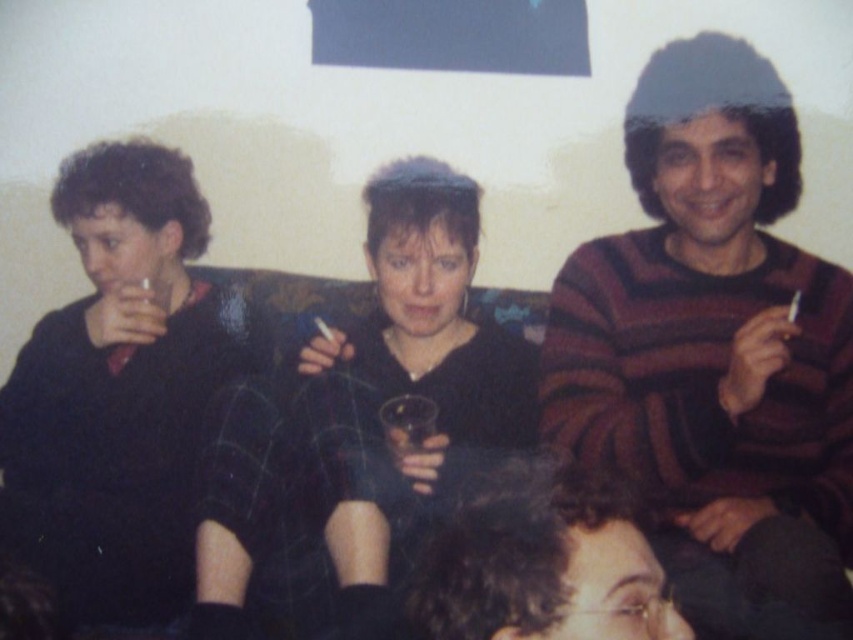
Does dark curly hair at lower center appear on the right side of translucent glass at center?

Indeed, dark curly hair at lower center is positioned on the right side of translucent glass at center.

Which is behind, point (589, 515) or point (426, 408)?

Point (426, 408)

Locate an element on the screen. dark curly hair at lower center is located at coordinates (538, 561).

Consider the image. Does black matte sweater at center have a lesser height compared to translucent glass at center?

No.

The width and height of the screenshot is (853, 640). What are the coordinates of `black matte sweater at center` in the screenshot? It's located at (360, 419).

Where is `black matte sweater at center`? This screenshot has height=640, width=853. black matte sweater at center is located at coordinates (360, 419).

Where is `black matte sweater at center`? This screenshot has height=640, width=853. black matte sweater at center is located at coordinates (360, 419).

Is point (345, 388) less distant than point (503, 500)?

That is False.

Find the location of a particular element. black matte sweater at center is located at coordinates (360, 419).